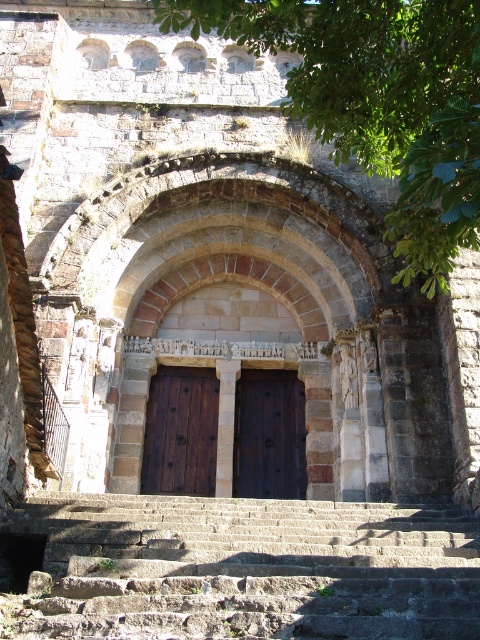
Question: Can you confirm if brown wooden door at center is positioned above dark wood door at center?

Choices:
 (A) no
 (B) yes

Answer: (B)

Question: Can you confirm if green leafy tree at upper center is positioned to the left of dark wood door at center?

Choices:
 (A) yes
 (B) no

Answer: (B)

Question: Which object appears closest to the camera in this image?

Choices:
 (A) green leafy tree at upper center
 (B) brown wooden door at center
 (C) rustic stone stairs at lower center

Answer: (A)

Question: Estimate the real-world distances between objects in this image. Which object is farther from the rustic stone stairs at lower center?

Choices:
 (A) brown wooden door at center
 (B) dark wood door at center

Answer: (B)

Question: Which of these objects is positioned farthest from the dark wood door at center?

Choices:
 (A) brown wooden door at center
 (B) rustic stone stairs at lower center

Answer: (B)

Question: In this image, where is green leafy tree at upper center located relative to brown wooden door at center?

Choices:
 (A) below
 (B) above

Answer: (B)